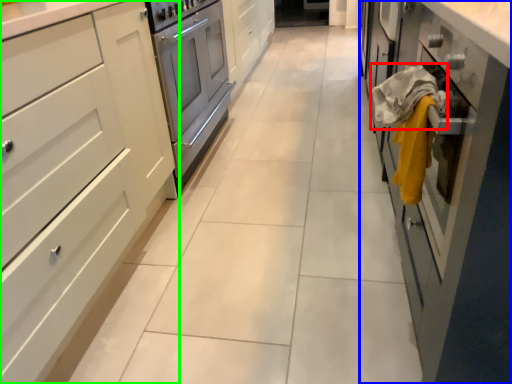
Question: Based on their relative distances, which object is farther from blanket (highlighted by a red box)? Choose from cabinetry (highlighted by a blue box) and cabinetry (highlighted by a green box).

Choices:
 (A) cabinetry
 (B) cabinetry

Answer: (B)